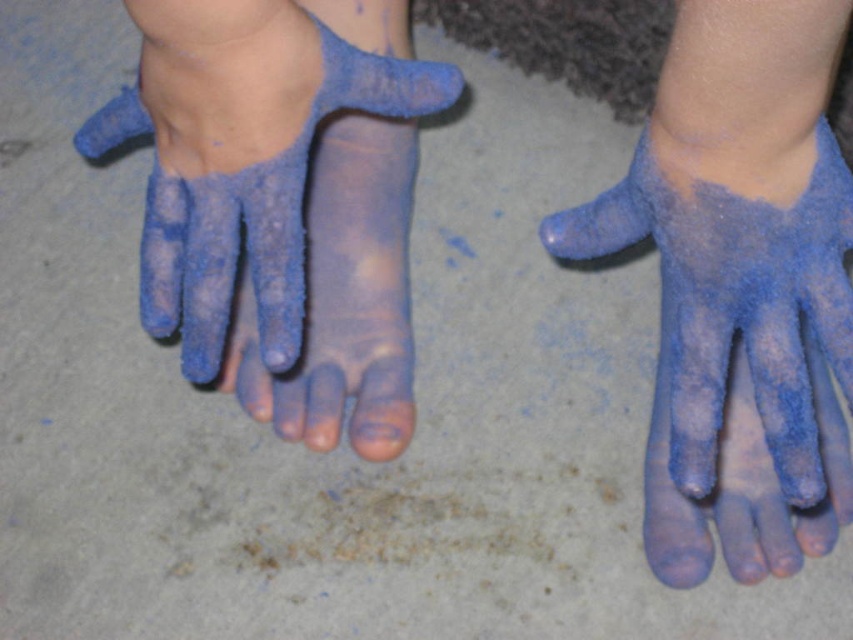
Question: Which of the following is the closest to the observer?

Choices:
 (A) blue matte sand at center
 (B) blue powder foot at center

Answer: (B)

Question: Is blue matte sand at center smaller than blue fuzzy glove at center?

Choices:
 (A) no
 (B) yes

Answer: (A)

Question: Which of the following is the closest to the observer?

Choices:
 (A) (672, 358)
 (B) (764, 548)
 (C) (251, 410)

Answer: (A)

Question: Which object is positioned farthest from the blue fuzzy glove at center?

Choices:
 (A) blue powder foot at center
 (B) blue matte sand at center

Answer: (B)

Question: Is blue powder foot at center positioned before blue matte sand at center?

Choices:
 (A) no
 (B) yes

Answer: (B)

Question: From the image, what is the correct spatial relationship of blue powder foot at center in relation to blue fuzzy glove at center?

Choices:
 (A) right
 (B) left

Answer: (B)